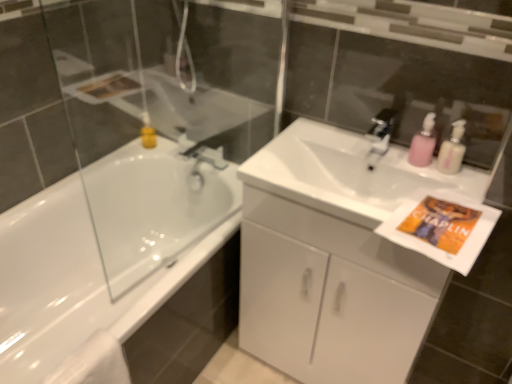
Question: From a real-world perspective, is pink plastic soap dispenser at upper right positioned above or below white matte towel at lower left?

Choices:
 (A) above
 (B) below

Answer: (A)

Question: Would you say pink plastic soap dispenser at upper right is inside or outside white matte towel at lower left?

Choices:
 (A) outside
 (B) inside

Answer: (A)

Question: Which is nearer to the white glossy sink at center?

Choices:
 (A) white glossy bathtub at left
 (B) white glossy cabinet at center
 (C) pink plastic soap dispenser at upper right
 (D) white matte towel at lower left
 (E) pink plastic pump at upper right

Answer: (C)

Question: Which is farther from the white glossy bathtub at left?

Choices:
 (A) white glossy cabinet at center
 (B) pink plastic pump at upper right
 (C) pink plastic soap dispenser at upper right
 (D) white glossy sink at center
 (E) white matte towel at lower left

Answer: (B)